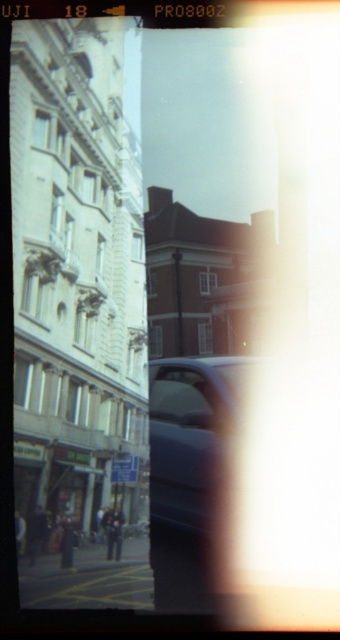
Can you confirm if metallic blue car at center is thinner than transparent glass car window at center?

No, metallic blue car at center is not thinner than transparent glass car window at center.

Describe the element at coordinates (190, 477) in the screenshot. This screenshot has width=340, height=640. I see `metallic blue car at center` at that location.

The height and width of the screenshot is (640, 340). What are the coordinates of `metallic blue car at center` in the screenshot? It's located at (190, 477).